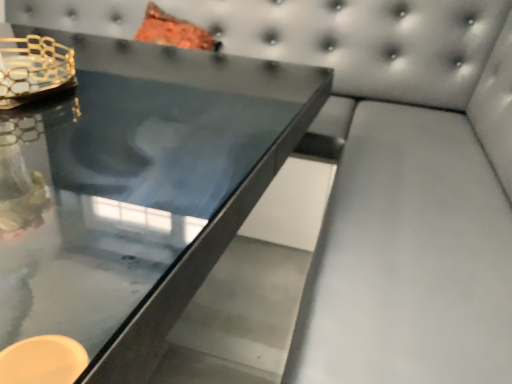
This screenshot has width=512, height=384. Identify the location of vacant area that lies to the right of gold mesh candle holder at upper left. (96, 105).